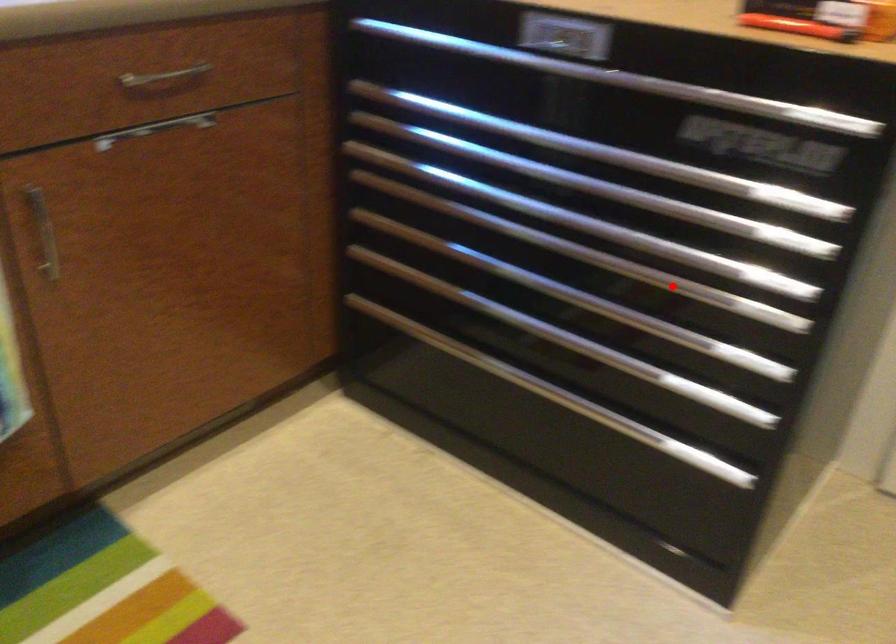
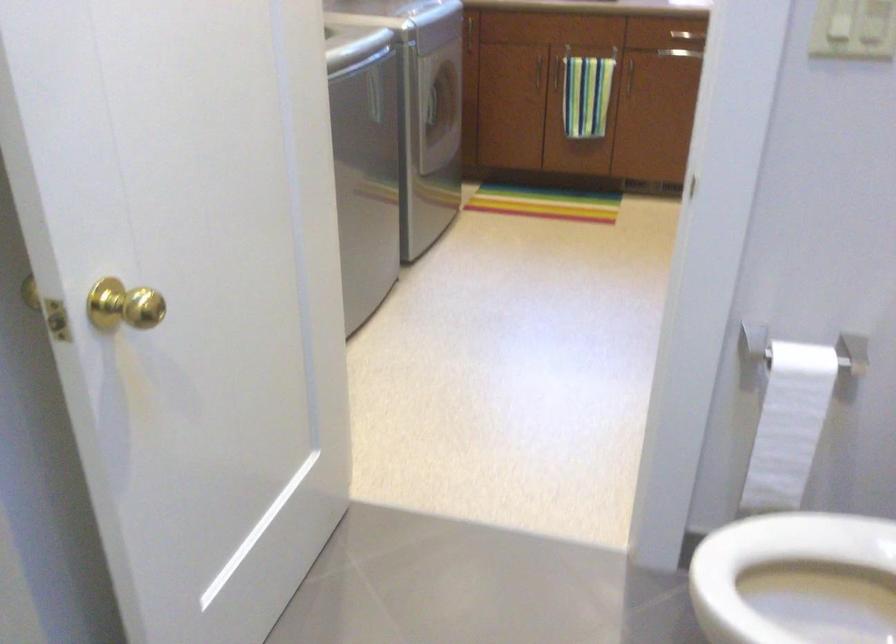
Question: I am providing you with two images of the same scene from different viewpoints. A red point is marked on the first image. At the location where the point appears in image 1, is it still visible in image 2?

Choices:
 (A) Yes
 (B) No

Answer: (B)